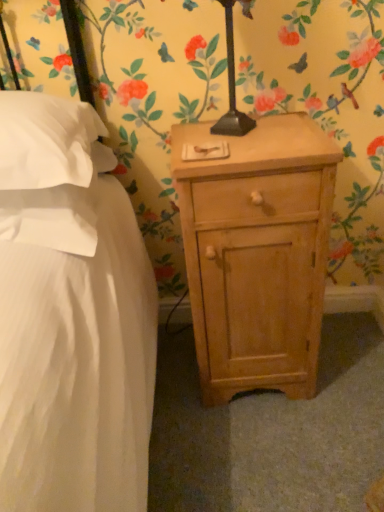
Question: Could you tell me if white soft pillow at left, placed as the 2th pillow when sorted from bottom to top, is facing white soft pillow at left, which is the 2th pillow from top to bottom?

Choices:
 (A) no
 (B) yes

Answer: (A)

Question: Considering the relative positions of white soft pillow at left, the first pillow in the top-to-bottom sequence, and white soft pillow at left, which is the 2th pillow from top to bottom, in the image provided, is white soft pillow at left, the first pillow in the top-to-bottom sequence, behind white soft pillow at left, which is the 2th pillow from top to bottom,?

Choices:
 (A) no
 (B) yes

Answer: (A)

Question: Can you see white soft pillow at left, placed as the 2th pillow when sorted from bottom to top, touching white soft pillow at left, which is the 2th pillow from top to bottom?

Choices:
 (A) no
 (B) yes

Answer: (A)

Question: Does white soft pillow at left, the first pillow in the top-to-bottom sequence, have a larger size compared to white soft pillow at left, positioned as the 1th pillow in bottom-to-top order?

Choices:
 (A) yes
 (B) no

Answer: (A)

Question: Is white soft pillow at left, positioned as the 1th pillow in bottom-to-top order, inside white soft pillow at left, the first pillow in the top-to-bottom sequence?

Choices:
 (A) no
 (B) yes

Answer: (A)

Question: Is white soft pillow at left, positioned as the 1th pillow in bottom-to-top order, taller or shorter than white soft pillow at left, placed as the 2th pillow when sorted from bottom to top?

Choices:
 (A) tall
 (B) short

Answer: (B)

Question: Is white soft pillow at left, positioned as the 1th pillow in bottom-to-top order, inside the boundaries of white soft pillow at left, placed as the 2th pillow when sorted from bottom to top, or outside?

Choices:
 (A) outside
 (B) inside

Answer: (A)

Question: In the image, is white soft pillow at left, positioned as the 1th pillow in bottom-to-top order, positioned in front of or behind white soft pillow at left, placed as the 2th pillow when sorted from bottom to top?

Choices:
 (A) front
 (B) behind

Answer: (B)

Question: Is white soft pillow at left, positioned as the 1th pillow in bottom-to-top order, wider or thinner than white soft pillow at left, placed as the 2th pillow when sorted from bottom to top?

Choices:
 (A) wide
 (B) thin

Answer: (B)

Question: In the image, is light wood nightstand at lower right positioned in front of or behind white soft pillow at left, placed as the 2th pillow when sorted from bottom to top?

Choices:
 (A) behind
 (B) front

Answer: (A)

Question: In terms of size, does light wood nightstand at lower right appear bigger or smaller than white soft pillow at left, the first pillow in the top-to-bottom sequence?

Choices:
 (A) big
 (B) small

Answer: (A)

Question: From their relative heights in the image, would you say light wood nightstand at lower right is taller or shorter than white soft pillow at left, placed as the 2th pillow when sorted from bottom to top?

Choices:
 (A) tall
 (B) short

Answer: (A)

Question: From the image's perspective, relative to white soft pillow at left, the first pillow in the top-to-bottom sequence, is light wood nightstand at lower right above or below?

Choices:
 (A) below
 (B) above

Answer: (A)

Question: From the image's perspective, is light wood nightstand at lower right positioned above or below white soft pillow at left, which is the 2th pillow from top to bottom?

Choices:
 (A) above
 (B) below

Answer: (B)

Question: Relative to white soft pillow at left, which is the 2th pillow from top to bottom, is light wood nightstand at lower right in front or behind?

Choices:
 (A) behind
 (B) front

Answer: (A)